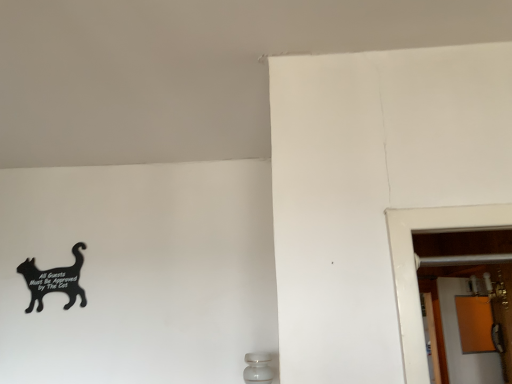
Question: Is black matte sign at lower left not within orange matte screen door at right?

Choices:
 (A) yes
 (B) no

Answer: (A)

Question: Considering the relative sizes of black matte sign at lower left and orange matte screen door at right in the image provided, is black matte sign at lower left bigger than orange matte screen door at right?

Choices:
 (A) no
 (B) yes

Answer: (A)

Question: From the image's perspective, would you say black matte sign at lower left is positioned over orange matte screen door at right?

Choices:
 (A) yes
 (B) no

Answer: (A)

Question: From a real-world perspective, is black matte sign at lower left located higher than orange matte screen door at right?

Choices:
 (A) no
 (B) yes

Answer: (B)

Question: From the image's perspective, is black matte sign at lower left under orange matte screen door at right?

Choices:
 (A) no
 (B) yes

Answer: (A)

Question: From a real-world perspective, is black matte sign at lower left physically below orange matte screen door at right?

Choices:
 (A) no
 (B) yes

Answer: (A)

Question: Is black matte sign at lower left a part of orange matte screen door at right?

Choices:
 (A) yes
 (B) no

Answer: (B)

Question: Are orange matte screen door at right and black matte sign at lower left far apart?

Choices:
 (A) no
 (B) yes

Answer: (B)

Question: Is orange matte screen door at right at the left side of black matte sign at lower left?

Choices:
 (A) yes
 (B) no

Answer: (B)

Question: Is orange matte screen door at right bigger than black matte sign at lower left?

Choices:
 (A) yes
 (B) no

Answer: (A)

Question: From the image's perspective, is orange matte screen door at right located beneath black matte sign at lower left?

Choices:
 (A) yes
 (B) no

Answer: (A)

Question: Can you confirm if orange matte screen door at right is taller than black matte sign at lower left?

Choices:
 (A) no
 (B) yes

Answer: (B)

Question: Is black matte sign at lower left taller or shorter than orange matte screen door at right?

Choices:
 (A) tall
 (B) short

Answer: (B)